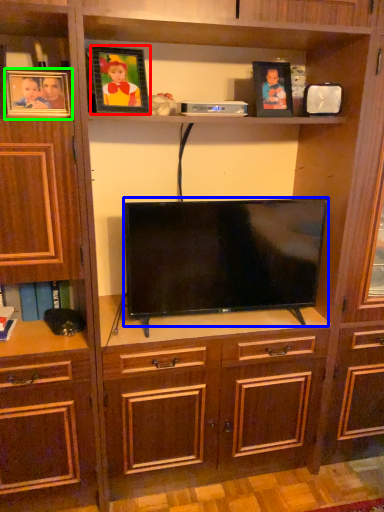
Question: Considering the real-world distances, which object is closest to picture frame (highlighted by a red box)? television (highlighted by a blue box) or picture frame (highlighted by a green box).

Choices:
 (A) television
 (B) picture frame

Answer: (B)